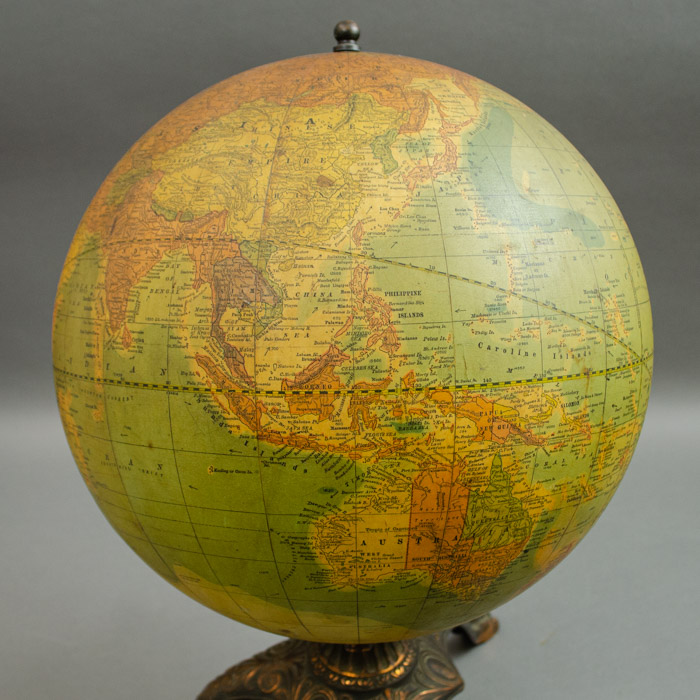
The width and height of the screenshot is (700, 700). In order to click on globe in this screenshot , I will do `click(414, 256)`.